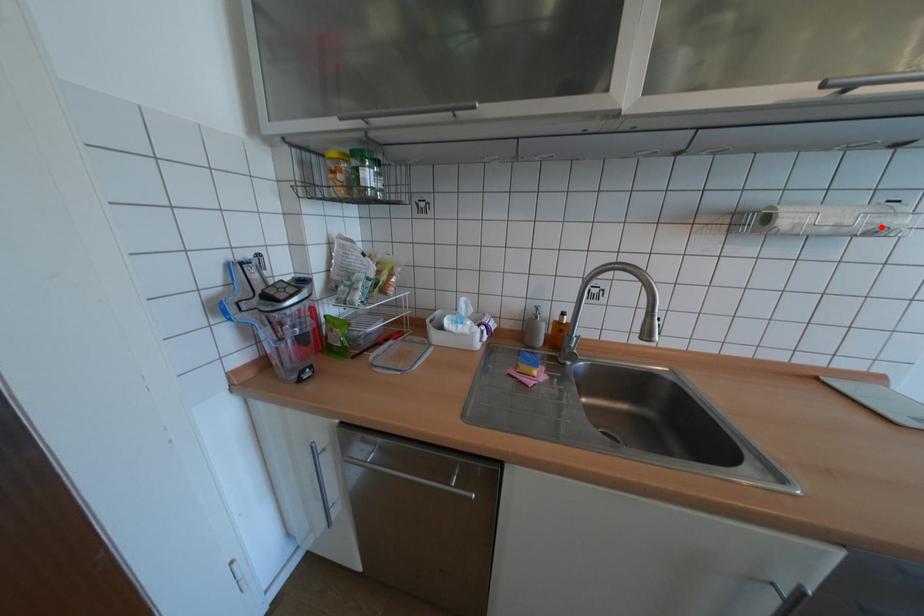
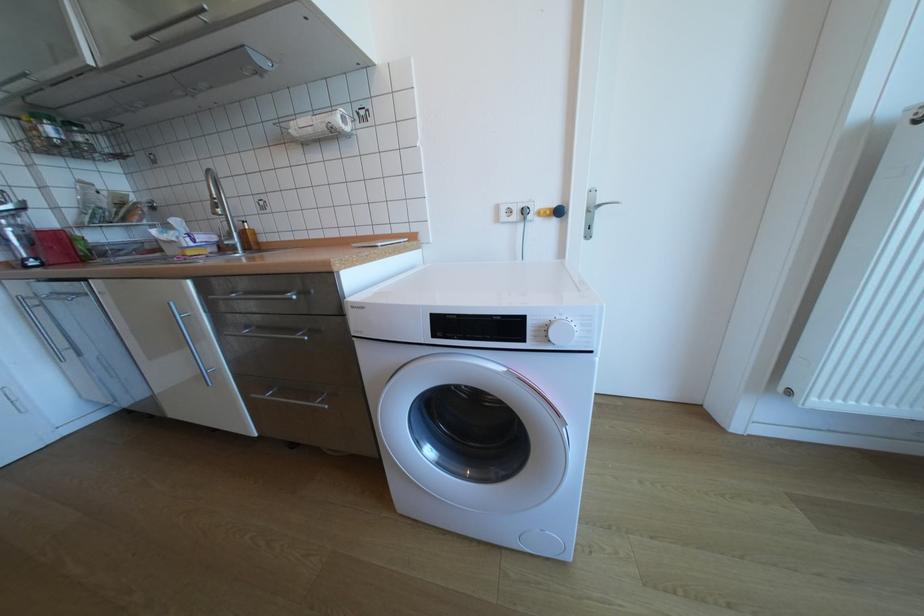
In the second image, find the point that corresponds to the highlighted location in the first image.

(334, 124)